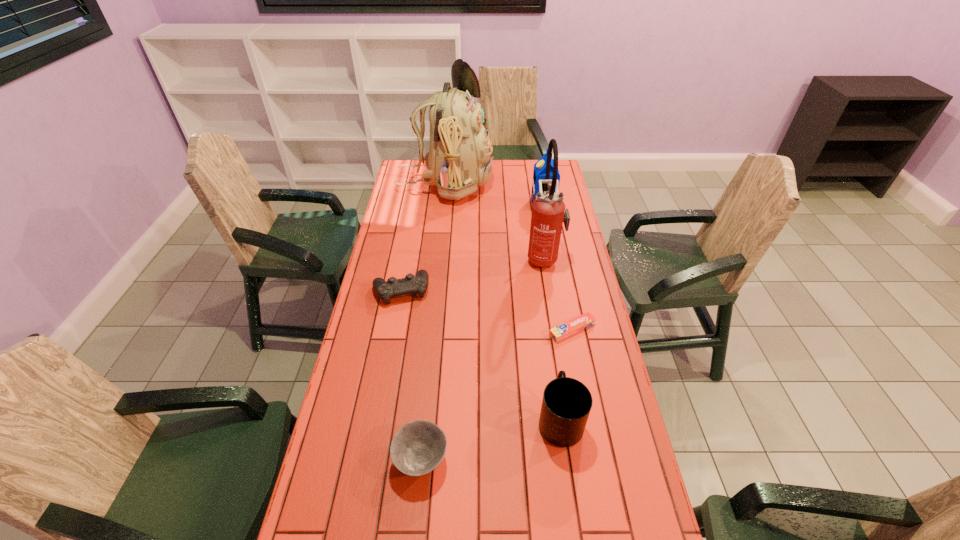
You are a GUI agent. You are given a task and a screenshot of the screen. Output one action in this format:
    pyautogui.click(x=<x>, y=<y>)
    Task: Click on the free spot between the toothpaste and the fifth nearest object
    This screenshot has width=960, height=540.
    Given the screenshot: What is the action you would take?
    pyautogui.click(x=558, y=294)

What are the coordinates of `free space that is in between the fifth farthest object and the backpack` in the screenshot? It's located at (509, 256).

At what (x,y) coordinates should I click in order to perform the action: click on the sixth closest object to the bowl. Please return your answer as a coordinate pair (x, y). The height and width of the screenshot is (540, 960). Looking at the image, I should click on (539, 173).

This screenshot has height=540, width=960. I want to click on the sixth closest object to the third farthest object, so click(x=418, y=447).

The width and height of the screenshot is (960, 540). What are the coordinates of `vacant space that satisfies the following two spatial constraints: 1. on the front side of the fourth nearest object; 2. on the right side of the bowl` in the screenshot? It's located at (370, 460).

Where is `vacant area that satisfies the following two spatial constraints: 1. on the side of the mug with the handle; 2. on the front-facing side of the backpack`? The image size is (960, 540). vacant area that satisfies the following two spatial constraints: 1. on the side of the mug with the handle; 2. on the front-facing side of the backpack is located at coordinates (526, 184).

Where is `vacant space that satisfies the following two spatial constraints: 1. on the front-facing side of the fifth farthest object; 2. on the right side of the backpack`? The height and width of the screenshot is (540, 960). vacant space that satisfies the following two spatial constraints: 1. on the front-facing side of the fifth farthest object; 2. on the right side of the backpack is located at coordinates (429, 330).

At what (x,y) coordinates should I click in order to perform the action: click on blank space that satisfies the following two spatial constraints: 1. with the cap open on the carton; 2. on the right side of the fifth farthest object. Please return your answer as a coordinate pair (x, y). The width and height of the screenshot is (960, 540). Looking at the image, I should click on (566, 330).

Where is `vacant point that satisfies the following two spatial constraints: 1. on the back side of the shortest object; 2. on the right side of the bowl`? This screenshot has height=540, width=960. vacant point that satisfies the following two spatial constraints: 1. on the back side of the shortest object; 2. on the right side of the bowl is located at coordinates (434, 330).

Where is `blank area in the image that satisfies the following two spatial constraints: 1. on the side of the fourth tallest object with the handle; 2. on the front-facing side of the backpack`? blank area in the image that satisfies the following two spatial constraints: 1. on the side of the fourth tallest object with the handle; 2. on the front-facing side of the backpack is located at coordinates [x=526, y=184].